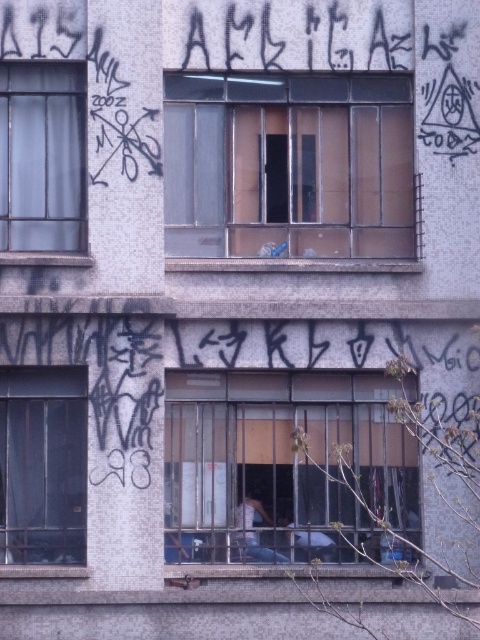
Is metallic bars at center below transparent glass window at left?

Correct, metallic bars at center is located below transparent glass window at left.

Between metallic bars at center and transparent glass window at left, which one appears on the right side from the viewer's perspective?

metallic bars at center

Looking at this image, who is more distant from viewer, (x=330, y=541) or (x=3, y=426)?

The point (x=330, y=541) is behind.

The height and width of the screenshot is (640, 480). What are the coordinates of `metallic bars at center` in the screenshot? It's located at point(280,465).

Who is lower down, metallic bars at center or clear glass window at upper left?

metallic bars at center is lower down.

In the scene shown: Who is taller, metallic bars at center or clear glass window at upper left?

With more height is metallic bars at center.

What do you see at coordinates (280, 465) in the screenshot? Image resolution: width=480 pixels, height=640 pixels. I see `metallic bars at center` at bounding box center [280, 465].

Find the location of a particular element. metallic bars at center is located at coordinates (280, 465).

Does clear glass window at upper center come behind transparent glass window at left?

Yes, it is behind transparent glass window at left.

Who is more distant from viewer, (280, 204) or (1, 545)?

The point (280, 204) is more distant.

Locate an element on the screen. This screenshot has height=640, width=480. clear glass window at upper center is located at coordinates (288, 164).